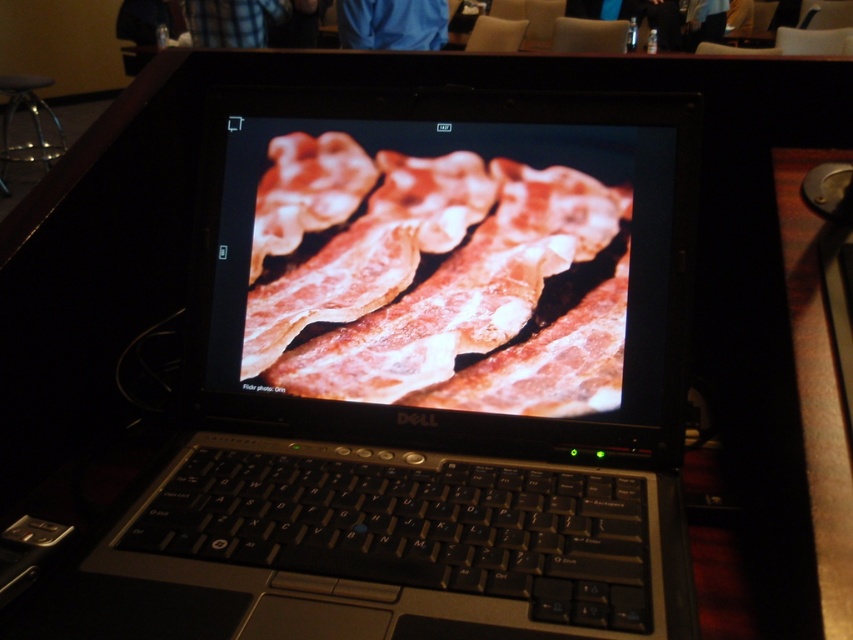
You are a delivery robot with a 1.5 inch wide package. You need to place the package on the wooden surface between the satin black laptop at center and the slightly crispy bacon at center. Can the package fit between them without overlapping either object?

The satin black laptop at center is 1.49 inches away from the slightly crispy bacon at center. Since the package is 1.5 inches wide, it cannot fit between them without overlapping one of the objects because the distance between the two items is slightly less than the package width.

You are a food delivery robot that needs to place a small plate of slightly crispy bacon at center on the satin black laptop at center. Is the laptop large enough to hold the plate without it hanging off the edges?

The satin black laptop at center is larger in size than slightly crispy bacon at center, so yes, the laptop is large enough to hold the plate without it hanging off the edges.